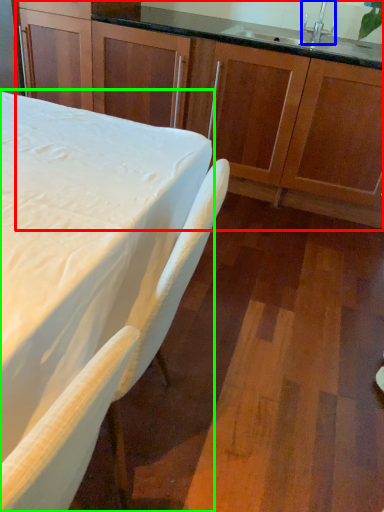
Question: Which object is positioned closest to cabinetry (highlighted by a red box)? Select from faucet (highlighted by a blue box) and table (highlighted by a green box).

Choices:
 (A) faucet
 (B) table

Answer: (A)